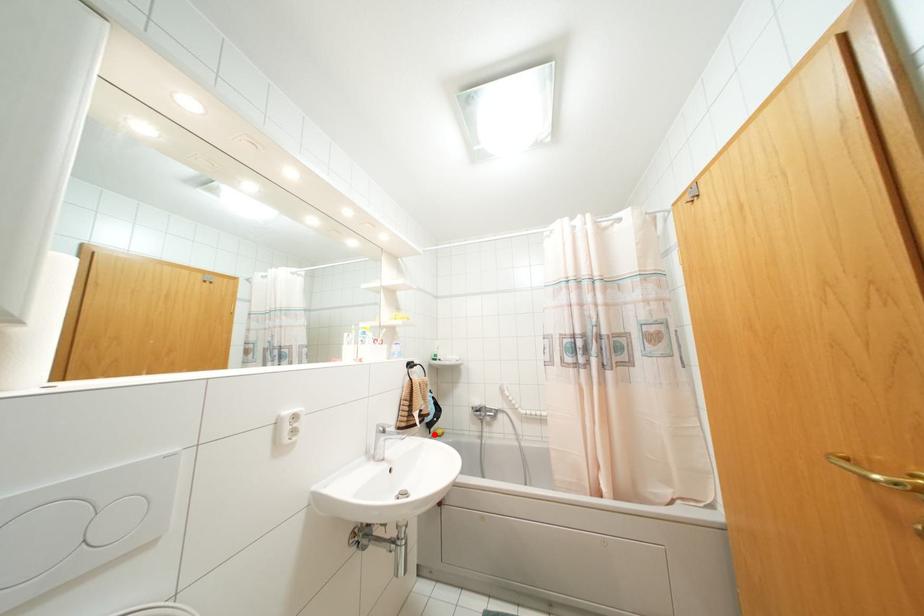
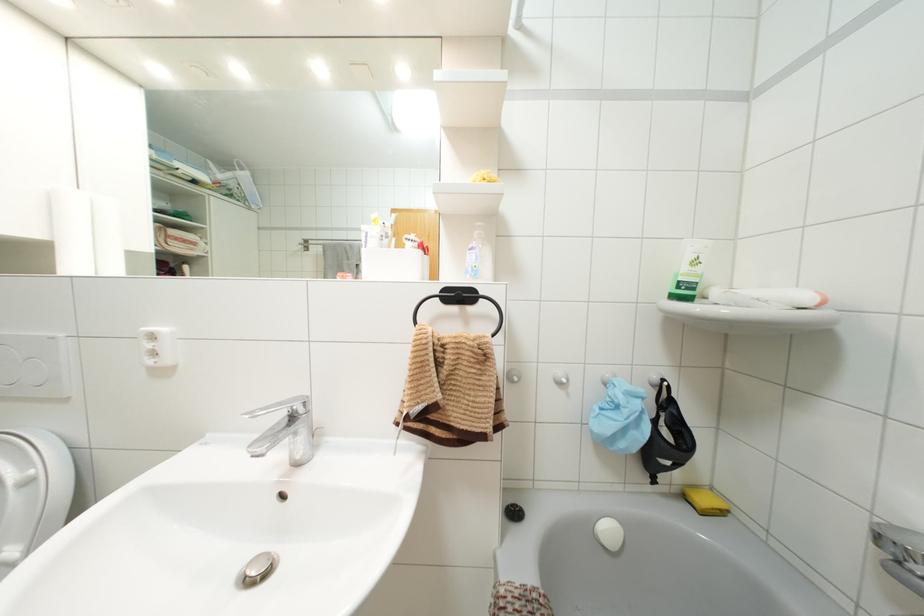
Question: I am providing you with two images of the same scene from different viewpoints. Given a red point in image1, look at the same physical point in image2. Is it:

Choices:
 (A) Closer to the viewpoint
 (B) Farther from the viewpoint

Answer: (A)